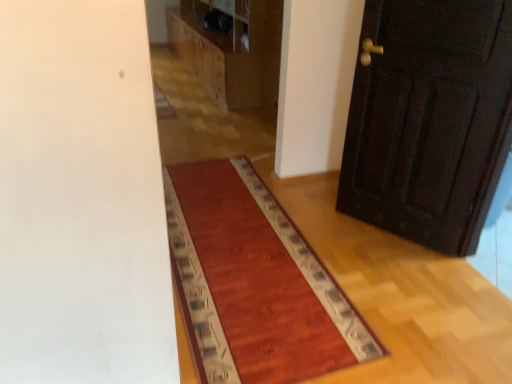
Question: Is dark wood door at right completely or partially outside of wooden dresser at upper center?

Choices:
 (A) no
 (B) yes

Answer: (B)

Question: Is the position of dark wood door at right more distant than that of wooden dresser at upper center?

Choices:
 (A) no
 (B) yes

Answer: (A)

Question: Does dark wood door at right have a greater width compared to wooden dresser at upper center?

Choices:
 (A) no
 (B) yes

Answer: (A)

Question: From the image's perspective, is dark wood door at right on top of wooden dresser at upper center?

Choices:
 (A) yes
 (B) no

Answer: (B)

Question: From a real-world perspective, does dark wood door at right sit lower than wooden dresser at upper center?

Choices:
 (A) yes
 (B) no

Answer: (B)

Question: Looking at their shapes, would you say wooden dresser at upper center is wider or thinner than rug with patterned border at center?

Choices:
 (A) wide
 (B) thin

Answer: (B)

Question: Considering the positions of wooden dresser at upper center and rug with patterned border at center in the image, is wooden dresser at upper center taller or shorter than rug with patterned border at center?

Choices:
 (A) short
 (B) tall

Answer: (B)

Question: Does point (206, 82) appear closer or farther from the camera than point (185, 269)?

Choices:
 (A) farther
 (B) closer

Answer: (A)

Question: Is wooden dresser at upper center in front of or behind rug with patterned border at center in the image?

Choices:
 (A) behind
 (B) front

Answer: (A)

Question: Is rug with patterned border at center taller or shorter than dark wood door at right?

Choices:
 (A) tall
 (B) short

Answer: (B)

Question: From the image's perspective, is rug with patterned border at center above or below dark wood door at right?

Choices:
 (A) below
 (B) above

Answer: (A)

Question: Relative to dark wood door at right, is rug with patterned border at center in front or behind?

Choices:
 (A) behind
 (B) front

Answer: (B)

Question: Does point (205, 211) appear closer or farther from the camera than point (371, 125)?

Choices:
 (A) closer
 (B) farther

Answer: (B)

Question: Based on their sizes in the image, would you say dark wood door at right is bigger or smaller than wooden dresser at upper center?

Choices:
 (A) big
 (B) small

Answer: (B)

Question: Is point (467, 14) closer or farther from the camera than point (186, 13)?

Choices:
 (A) farther
 (B) closer

Answer: (B)